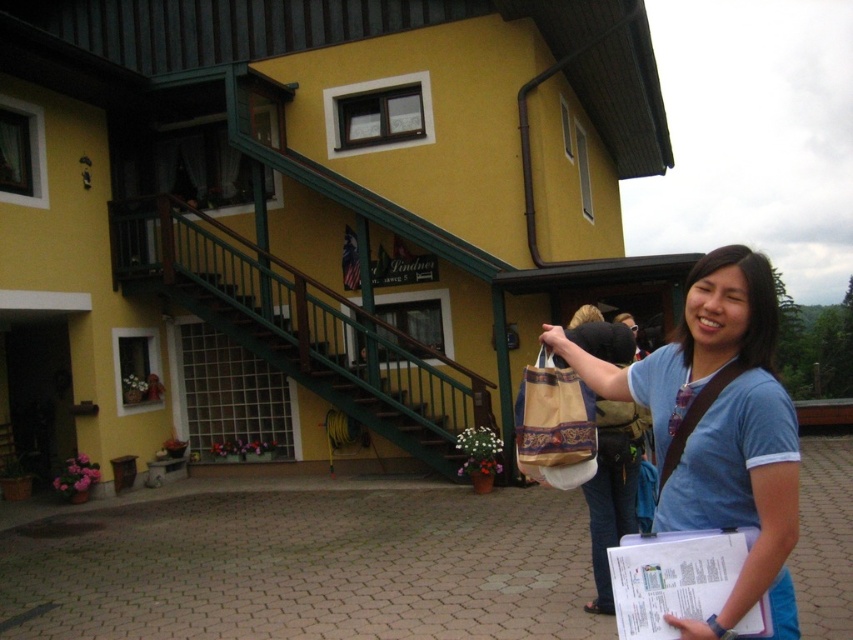
Is point (796, 532) behind point (550, 413)?

That is False.

Can you confirm if matte blue shirt at center is shorter than brown woven tote bag at center?

In fact, matte blue shirt at center may be taller than brown woven tote bag at center.

Does point (728, 404) lie in front of point (564, 488)?

That is True.

What are the coordinates of `matte blue shirt at center` in the screenshot? It's located at (718, 428).